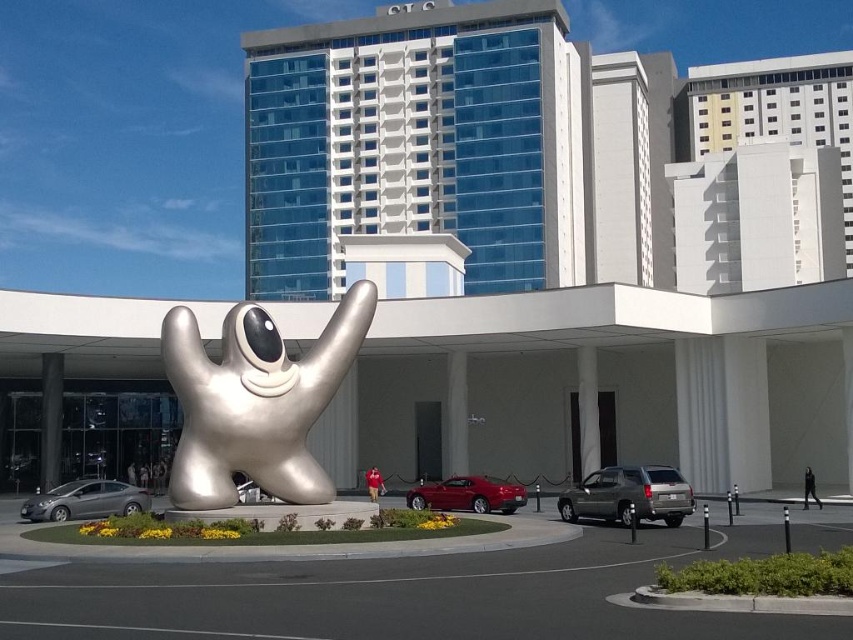
Between point (47, 518) and point (515, 492), which one is positioned in front?

Point (47, 518) is more forward.

Is silver metallic sedan at lower left positioned before glossy red car at center?

Yes, it is in front of glossy red car at center.

Who is more distant from viewer, (120, 483) or (492, 488)?

The point (120, 483) is behind.

I want to click on silver metallic sedan at lower left, so click(x=85, y=500).

Which is above, matte gray suv at center or glossy red car at center?

matte gray suv at center is above.

Does point (669, 508) come behind point (419, 500)?

No, it is not.

Between point (582, 506) and point (503, 506), which one is positioned behind?

The point (503, 506) is behind.

Where is `matte gray suv at center`? The height and width of the screenshot is (640, 853). matte gray suv at center is located at coordinates (630, 496).

Consider the image. Who is taller, silver metallic sculpture at center or matte gray suv at center?

Standing taller between the two is silver metallic sculpture at center.

Is point (291, 397) positioned in front of point (636, 493)?

Yes.

Image resolution: width=853 pixels, height=640 pixels. Find the location of `silver metallic sculpture at center`. silver metallic sculpture at center is located at coordinates (254, 401).